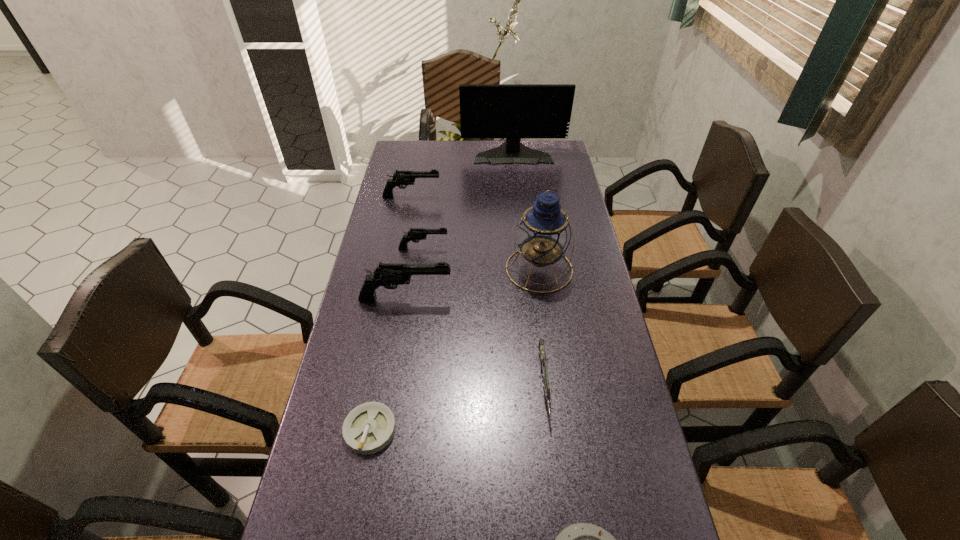
Find the location of a particular element. free spot between the farthest gun and the gray ashtray is located at coordinates (391, 313).

Choose which object is the fifth nearest neighbor to the lantern. Please provide its 2D coordinates. Your answer should be formatted as a tuple, i.e. [(x, y)], where the tuple contains the x and y coordinates of a point satisfying the conditions above.

[(368, 428)]

Locate an element on the screen. Image resolution: width=960 pixels, height=540 pixels. object that stands as the seventh closest to the sixth tallest object is located at coordinates (513, 111).

Select which gun is the third closest to the farthest black gun. Please provide its 2D coordinates. Your answer should be formatted as a tuple, i.e. [(x, y)], where the tuple contains the x and y coordinates of a point satisfying the conditions above.

[(543, 361)]

Identify the location of gun that is the third closest to the ashtray. This screenshot has height=540, width=960. (414, 234).

Select which black gun appears as the third closest to the monitor. Please provide its 2D coordinates. Your answer should be formatted as a tuple, i.e. [(x, y)], where the tuple contains the x and y coordinates of a point satisfying the conditions above.

[(389, 275)]

Identify which black gun is the nearest to the blue lantern. Please provide its 2D coordinates. Your answer should be formatted as a tuple, i.e. [(x, y)], where the tuple contains the x and y coordinates of a point satisfying the conditions above.

[(389, 275)]

You are a GUI agent. You are given a task and a screenshot of the screen. Output one action in this format:
    pyautogui.click(x=<x>, y=<y>)
    Task: Click on the vacant area in the image that satisfies the following two spatial constraints: 1. at the end of the barrel of the second tallest gun; 2. on the back side of the shortest object
    
    Given the screenshot: What is the action you would take?
    pyautogui.click(x=368, y=430)

Locate an element on the screen. The height and width of the screenshot is (540, 960). free region that satisfies the following two spatial constraints: 1. on the screen side of the monitor; 2. at the end of the barrel of the second farthest object is located at coordinates (517, 197).